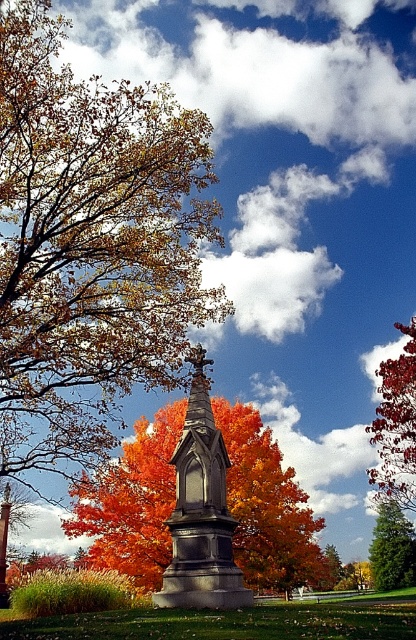
Which is above, smooth red tree at right or green textured tree at lower right?

smooth red tree at right

Does smooth red tree at right appear on the right side of green textured tree at lower right?

In fact, smooth red tree at right is to the left of green textured tree at lower right.

Is point (411, 458) less distant than point (398, 516)?

Yes, it is.

Find the location of `smooth red tree at right`. smooth red tree at right is located at coordinates (396, 426).

Is granite monument at center to the right of smooth red tree at right from the viewer's perspective?

In fact, granite monument at center is to the left of smooth red tree at right.

Looking at this image, is granite monument at center positioned in front of smooth red tree at right?

Yes.

The width and height of the screenshot is (416, 640). Identify the location of granite monument at center. (200, 512).

Between point (19, 323) and point (101, 518), which one is positioned behind?

The point (101, 518) is more distant.

Between point (148, 353) and point (260, 472), which one is positioned behind?

The point (260, 472) is more distant.

Find the location of `autumn leaves at center`. autumn leaves at center is located at coordinates pos(91,248).